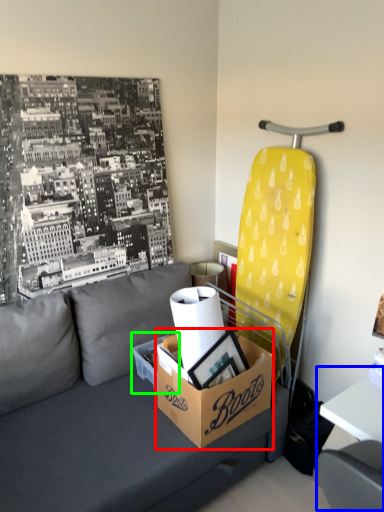
Question: Which object is positioned closest to box (highlighted by a red box)? Select from table (highlighted by a blue box) and cardboard box (highlighted by a green box).

Choices:
 (A) table
 (B) cardboard box

Answer: (B)